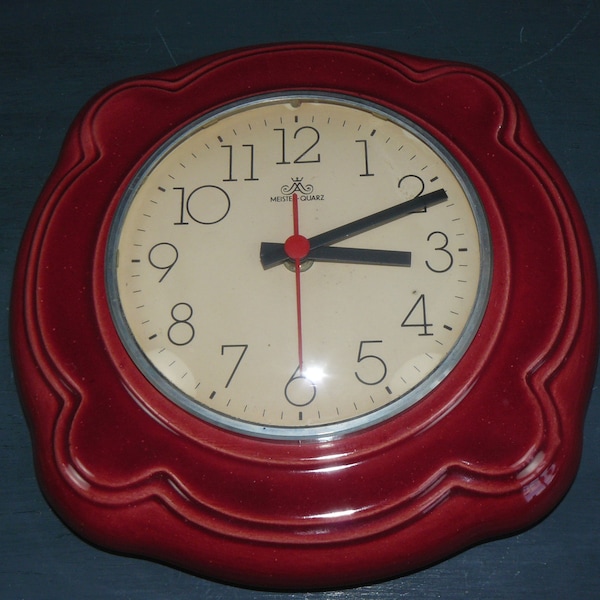
Identify the location of ceramic clock frame. (300, 500).